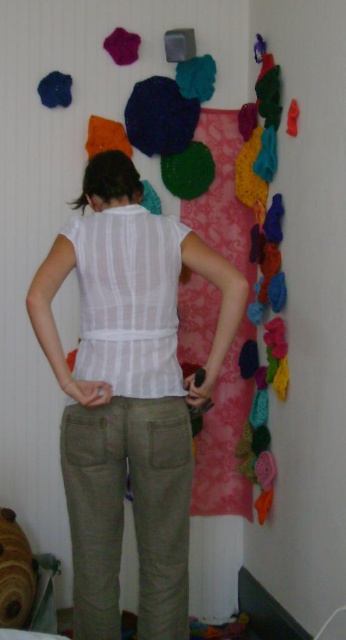
You are an interior designer analyzing the placement of items in the room. Given the coordinates provided for the olive green cotton pants at lower center, can you determine if they are positioned to the left or right of the pink lace fabric hanging vertically in the center?

The olive green cotton pants at lower center is located at point (132, 512). Since the pink lace fabric is in the center, the pants are positioned to the right of it based on the x coordinate being higher than 0.5.

You are a photographer positioned at the camera. You want to capture a closeup shot of the light beige cotton pants at center. Given that your camera can focus on objects within 3 feet, will you be able to take the photo without moving closer?

The light beige cotton pants at center are 5.41 feet away from the camera. Since the camera can only focus on objects within 3 feet, you will need to move closer to take the closeup shot.

From the picture: Based on the scene description, where is the white sheer shirt at center located in terms of its 2D coordinates?

The white sheer shirt at center is located at the 2D coordinates of point (129, 300).